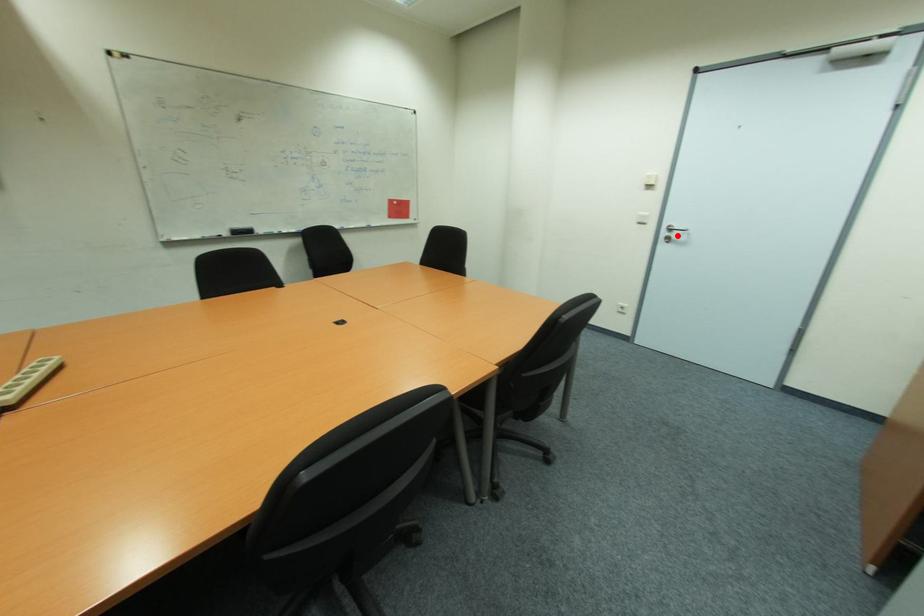
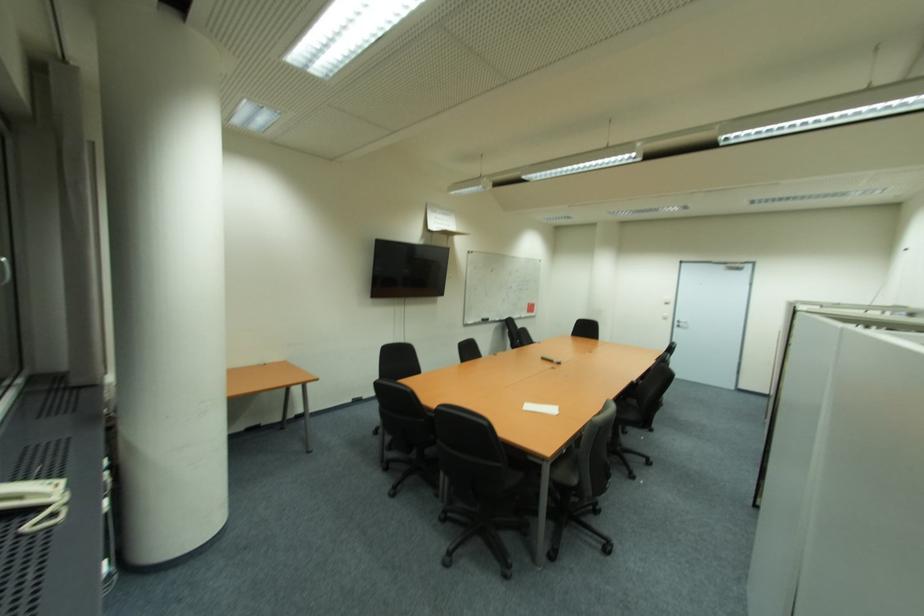
Question: A red point is marked in image1. In image2, is the corresponding 3D point closer to the camera or farther? Reply with the corresponding letter.

Choices:
 (A) The corresponding 3D point is closer.
 (B) The corresponding 3D point is farther.

Answer: (B)